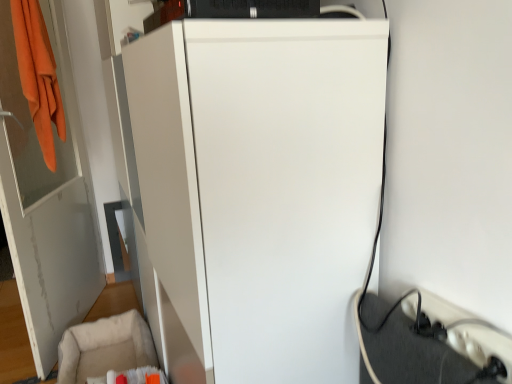
Question: In the image, is beige fabric swivel chair at lower left positioned in front of or behind white matte refrigerator at center?

Choices:
 (A) behind
 (B) front

Answer: (A)

Question: Do you think beige fabric swivel chair at lower left is within white matte refrigerator at center, or outside of it?

Choices:
 (A) outside
 (B) inside

Answer: (A)

Question: Estimate the real-world distances between objects in this image. Which object is farther from the white matte refrigerator at center?

Choices:
 (A) white plastic extension cord at lower right
 (B) white glossy door at left
 (C) beige fabric swivel chair at lower left

Answer: (B)

Question: Considering the real-world distances, which object is closest to the white plastic extension cord at lower right?

Choices:
 (A) white glossy door at left
 (B) white matte refrigerator at center
 (C) beige fabric swivel chair at lower left

Answer: (B)